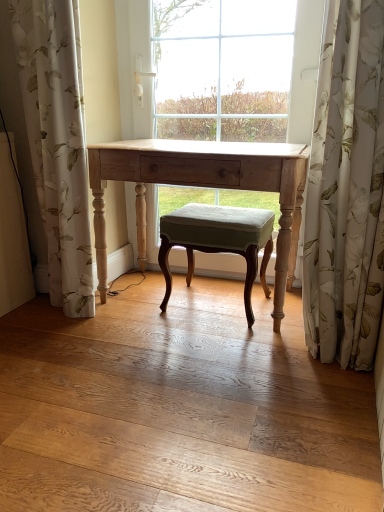
This screenshot has width=384, height=512. I want to click on free region on the left part of white floral fabric at right, which is the 2th curtain from left to right, so click(x=272, y=358).